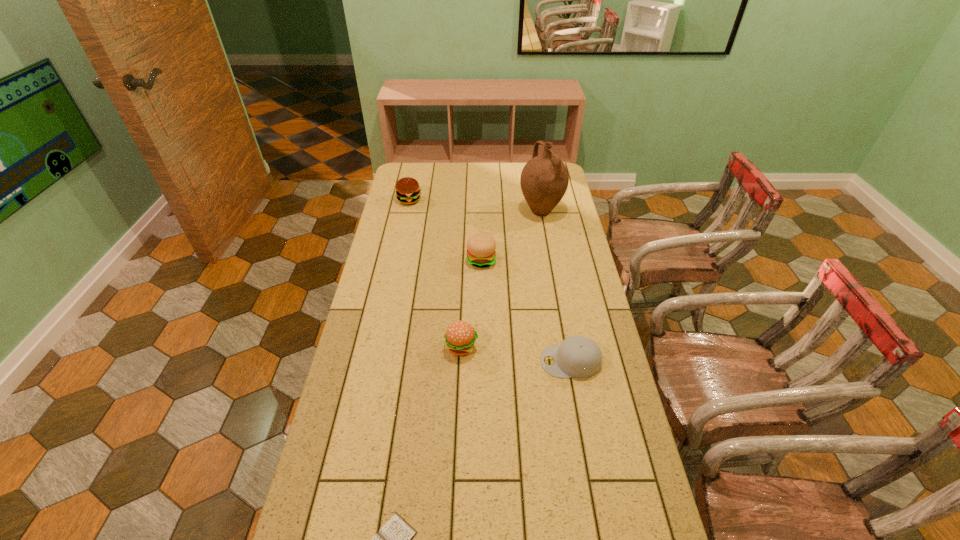
At what (x,y) coordinates should I click in order to perform the action: click on the tallest object. Please return your answer as a coordinate pair (x, y). Looking at the image, I should click on (544, 179).

What are the coordinates of `the leftmost hamburger` in the screenshot? It's located at (408, 192).

Find the location of `the second nearest hamburger`. the second nearest hamburger is located at coordinates (481, 247).

Locate an element on the screen. the nearest hamburger is located at coordinates (x=460, y=336).

Identify the location of cap. The width and height of the screenshot is (960, 540). (577, 356).

The height and width of the screenshot is (540, 960). I want to click on free location located 0.180m on the front of the pitcher, so (x=548, y=251).

The width and height of the screenshot is (960, 540). Find the location of `vacant space situated on the right of the leftmost hamburger`. vacant space situated on the right of the leftmost hamburger is located at coordinates (489, 200).

The image size is (960, 540). In order to click on vacant space located 0.180m on the front of the fourth nearest object in this screenshot , I will do [482, 303].

At what (x,y) coordinates should I click in order to perform the action: click on vacant point located 0.060m on the back of the nearest hamburger. Please return your answer as a coordinate pair (x, y). The image size is (960, 540). Looking at the image, I should click on (463, 321).

At what (x,y) coordinates should I click in order to perform the action: click on blank space located on the front-facing side of the second shortest object. Please return your answer as a coordinate pair (x, y). The height and width of the screenshot is (540, 960). Looking at the image, I should click on (465, 361).